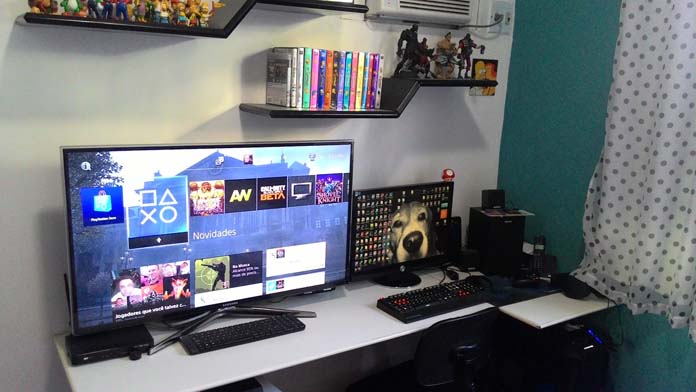
The width and height of the screenshot is (696, 392). I want to click on chair, so click(x=436, y=358).